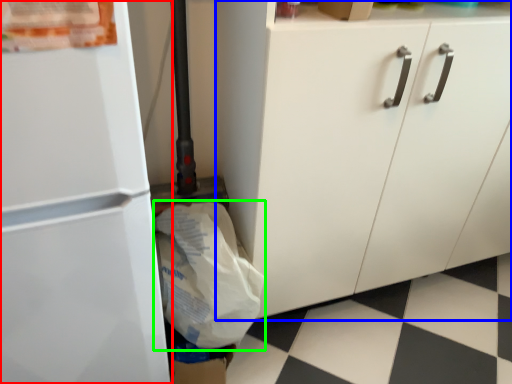
Question: Which object is positioned farthest from refrigerator (highlighted by a red box)? Select from cabinetry (highlighted by a blue box) and grocery bag (highlighted by a green box).

Choices:
 (A) cabinetry
 (B) grocery bag

Answer: (A)